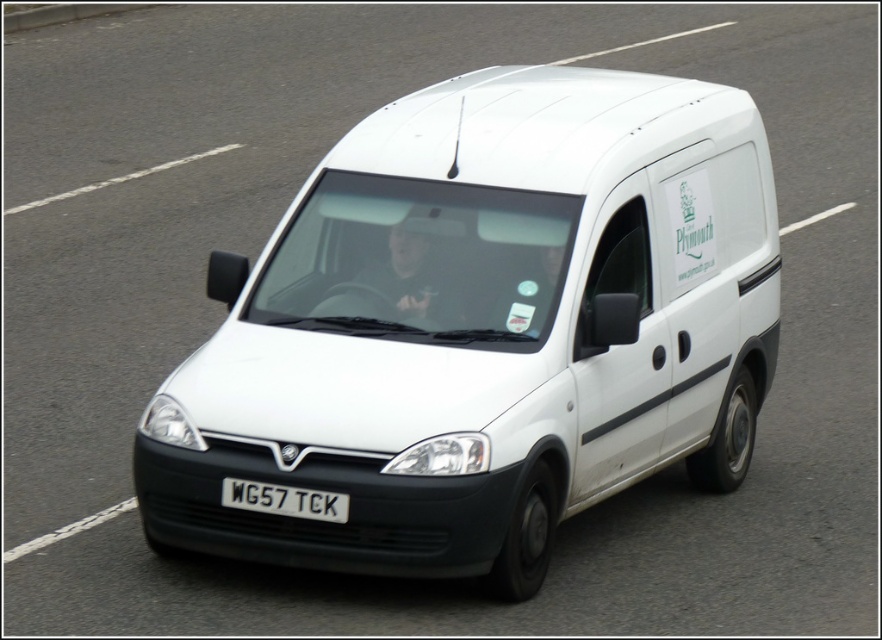
You are a photographer trying to capture the white matte van at center and the white plastic license plate at center in a single photo. However, your camera can only focus on objects at a specific distance. Which object should you focus on to ensure both are in focus?

You should focus on the white matte van at center because it is closer to the viewer than the white plastic license plate at center, so focusing on the closer object will keep both in focus.

You are a traffic officer observing a white matte van at center and a white plastic license plate at center. Which object is positioned higher from the ground?

The white matte van at center is above the white plastic license plate at center, so the white matte van at center is positioned higher from the ground.

You are a traffic camera monitoring the road. The system requires the van to be within a specific zone defined by coordinates between 0.5 and 0.6 in both x and y axes. Is the white matte van at center within this zone?

The white matte van at center is located at coordinates 0.512 and 0.548, which fall within the specified zone between 0.5 and 0.6 on both axes. Therefore, the van is within the required zone.